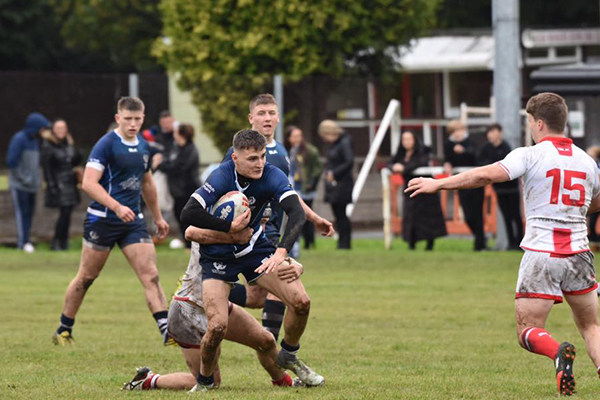
Where is `window`? This screenshot has width=600, height=400. window is located at coordinates (345, 105), (419, 99), (470, 84).